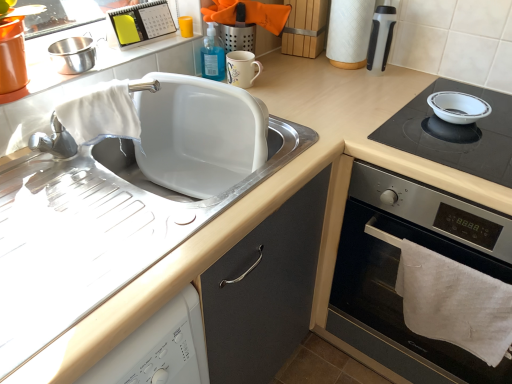
Question: Which direction should I rotate to face white plastic calendar at upper center, the second appliance when ordered from left to right, — up or down?

Choices:
 (A) up
 (B) down

Answer: (A)

Question: Is white cotton towel at lower right bigger than white matte sink at upper left?

Choices:
 (A) no
 (B) yes

Answer: (A)

Question: From a real-world perspective, is white cotton towel at lower right positioned over white matte sink at upper left based on gravity?

Choices:
 (A) yes
 (B) no

Answer: (B)

Question: Is white cotton towel at lower right facing away from white matte sink at upper left?

Choices:
 (A) yes
 (B) no

Answer: (B)

Question: Is white cotton towel at lower right oriented towards white matte sink at upper left?

Choices:
 (A) no
 (B) yes

Answer: (A)

Question: From the image's perspective, is white cotton towel at lower right over white matte sink at upper left?

Choices:
 (A) no
 (B) yes

Answer: (A)

Question: From the image's perspective, is white cotton towel at lower right beneath white matte sink at upper left?

Choices:
 (A) no
 (B) yes

Answer: (B)

Question: Does white glossy bowl at upper right lie in front of stainless steel bowl at upper left, the 4th appliance in the right-to-left sequence?

Choices:
 (A) no
 (B) yes

Answer: (B)

Question: From the image's perspective, is white glossy bowl at upper right on stainless steel bowl at upper left, the first appliance from the left?

Choices:
 (A) no
 (B) yes

Answer: (A)

Question: Considering the relative positions of white glossy bowl at upper right and stainless steel bowl at upper left, the 4th appliance in the right-to-left sequence, in the image provided, is white glossy bowl at upper right to the left of stainless steel bowl at upper left, the 4th appliance in the right-to-left sequence, from the viewer's perspective?

Choices:
 (A) no
 (B) yes

Answer: (A)

Question: Is white glossy bowl at upper right positioned beyond the bounds of stainless steel bowl at upper left, the first appliance from the left?

Choices:
 (A) yes
 (B) no

Answer: (A)

Question: Could you tell me if white glossy bowl at upper right is turned towards stainless steel bowl at upper left, the first appliance from the left?

Choices:
 (A) no
 (B) yes

Answer: (A)

Question: From a real-world perspective, is white glossy bowl at upper right located beneath stainless steel bowl at upper left, the 4th appliance in the right-to-left sequence?

Choices:
 (A) no
 (B) yes

Answer: (B)

Question: Considering the relative sizes of black glass cooktop at right and white cotton towel at lower right in the image provided, is black glass cooktop at right thinner than white cotton towel at lower right?

Choices:
 (A) no
 (B) yes

Answer: (A)